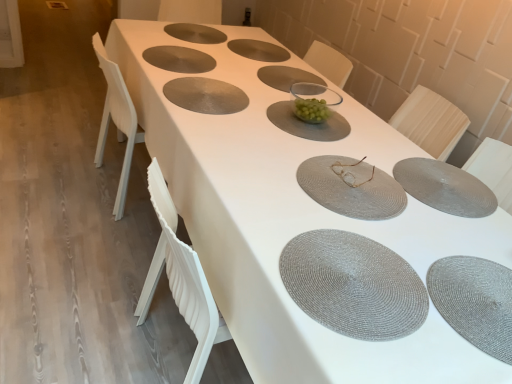
At what (x,y) coordinates should I click in order to perform the action: click on vacant space underneath gray woven placemat at center (from a real-world perspective). Please return your answer as a coordinate pair (x, y). This screenshot has width=512, height=384. Looking at the image, I should click on (357, 286).